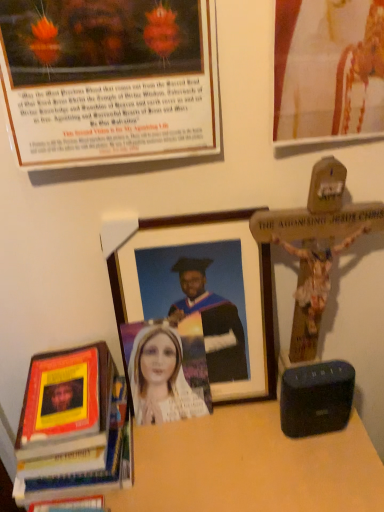
This screenshot has height=512, width=384. What do you see at coordinates (73, 424) in the screenshot?
I see `hardcover book at lower left` at bounding box center [73, 424].

Measure the distance between point (x=353, y=0) and camera.

A distance of 22.44 inches exists between point (x=353, y=0) and camera.

Describe the element at coordinates (328, 71) in the screenshot. I see `matte gold picture frame at upper right, the 3th picture frame positioned from the bottom` at that location.

Where is `matte plastic portrait at center`? The height and width of the screenshot is (512, 384). matte plastic portrait at center is located at coordinates (167, 370).

Identify the location of table on the left of matte gold picture frame at upper right, which is counted as the first picture frame, starting from the top. (250, 466).

Is wooden table at lower center to the left of matte gold picture frame at upper right, which is counted as the first picture frame, starting from the top, from the viewer's perspective?

Yes, wooden table at lower center is to the left of matte gold picture frame at upper right, which is counted as the first picture frame, starting from the top.

Could you tell me if wooden table at lower center is turned towards matte gold picture frame at upper right, the 3th picture frame positioned from the bottom?

No, wooden table at lower center is not aimed at matte gold picture frame at upper right, the 3th picture frame positioned from the bottom.

Based on the photo, how much distance is there between wooden table at lower center and matte gold picture frame at upper right, the 3th picture frame positioned from the bottom?

22.11 inches.

The height and width of the screenshot is (512, 384). Identify the location of the 2nd picture frame below the matte gold picture frame at upper right, the 3th picture frame positioned from the bottom (from the image's perspective). (200, 290).

Is point (326, 18) behind point (243, 368)?

No, it is in front of (243, 368).

Is there a large distance between matte gold picture frame at upper right, which is counted as the first picture frame, starting from the top, and wooden picture frame at center, acting as the 1th picture frame starting from the bottom?

No, matte gold picture frame at upper right, which is counted as the first picture frame, starting from the top, is not far away from wooden picture frame at center, acting as the 1th picture frame starting from the bottom.

From their relative heights in the image, would you say black plastic speaker at lower right is taller or shorter than wooden picture frame at center, placed as the third picture frame when sorted from top to bottom?

Clearly, black plastic speaker at lower right is shorter compared to wooden picture frame at center, placed as the third picture frame when sorted from top to bottom.

Can you tell me how much black plastic speaker at lower right and wooden picture frame at center, placed as the third picture frame when sorted from top to bottom, differ in facing direction?

The angular difference between black plastic speaker at lower right and wooden picture frame at center, placed as the third picture frame when sorted from top to bottom, is 6.21 degrees.

Looking at this image, who is smaller, black plastic speaker at lower right or wooden picture frame at center, placed as the third picture frame when sorted from top to bottom?

black plastic speaker at lower right is smaller.

In terms of size, does wooden table at lower center appear bigger or smaller than wooden picture frame at center, acting as the 1th picture frame starting from the bottom?

Considering their sizes, wooden table at lower center takes up more space than wooden picture frame at center, acting as the 1th picture frame starting from the bottom.

Considering the sizes of objects wooden table at lower center and wooden picture frame at center, placed as the third picture frame when sorted from top to bottom, in the image provided, who is taller, wooden table at lower center or wooden picture frame at center, placed as the third picture frame when sorted from top to bottom,?

wooden table at lower center is taller.

How different are the orientations of wooden table at lower center and wooden picture frame at center, acting as the 1th picture frame starting from the bottom, in degrees?

wooden table at lower center and wooden picture frame at center, acting as the 1th picture frame starting from the bottom, are facing 0.00174 degrees away from each other.

Which of these two, wooden table at lower center or wooden picture frame at center, placed as the third picture frame when sorted from top to bottom, is thinner?

wooden picture frame at center, placed as the third picture frame when sorted from top to bottom, is thinner.

The image size is (384, 512). Identify the location of woman above the black plastic speaker at lower right (from a real-world perspective). (167, 370).

Does point (154, 346) appear closer or farther from the camera than point (314, 412)?

Point (154, 346) appears to be farther away from the viewer than point (314, 412).

Does matte plastic portrait at center contain black plastic speaker at lower right?

No, black plastic speaker at lower right is not surrounded by matte plastic portrait at center.

Which point is more forward, (176,337) or (381,37)?

Answer: Point (381,37)

Measure the distance from matte plastic portrait at center to matte gold picture frame at upper right, which is counted as the first picture frame, starting from the top.

matte plastic portrait at center is 18.02 inches away from matte gold picture frame at upper right, which is counted as the first picture frame, starting from the top.

Where is `woman below the matte gold picture frame at upper right, the 3th picture frame positioned from the bottom (from a real-world perspective)`? woman below the matte gold picture frame at upper right, the 3th picture frame positioned from the bottom (from a real-world perspective) is located at coordinates (167, 370).

Is matte wooden picture frame at upper left, the 2th picture frame in the top-to-bottom sequence, further to the viewer compared to wooden table at lower center?

No.

Can we say matte wooden picture frame at upper left, which is the 2th picture frame in bottom-to-top order, lies outside wooden table at lower center?

Indeed, matte wooden picture frame at upper left, which is the 2th picture frame in bottom-to-top order, is completely outside wooden table at lower center.

Is point (186, 76) closer or farther from the camera than point (176, 471)?

Point (186, 76).

Based on their positions, is matte wooden picture frame at upper left, which is the 2th picture frame in bottom-to-top order, located to the left or right of wooden table at lower center?

From the image, it's evident that matte wooden picture frame at upper left, which is the 2th picture frame in bottom-to-top order, is to the left of wooden table at lower center.

Find the location of `table located behind the matte gold picture frame at upper right, which is counted as the first picture frame, starting from the top`. table located behind the matte gold picture frame at upper right, which is counted as the first picture frame, starting from the top is located at coordinates (250, 466).

Locate an element on the screen. picture frame on the right of wooden picture frame at center, acting as the 1th picture frame starting from the bottom is located at coordinates (328, 71).

Looking at the image, which one is located further to wooden picture frame at center, placed as the third picture frame when sorted from top to bottom, black plastic speaker at lower right or matte wooden picture frame at upper left, which is the 2th picture frame in bottom-to-top order?

The object further to wooden picture frame at center, placed as the third picture frame when sorted from top to bottom, is matte wooden picture frame at upper left, which is the 2th picture frame in bottom-to-top order.

When comparing their distances from hardcover book at lower left, does wooden table at lower center or matte wooden picture frame at upper left, which is the 2th picture frame in bottom-to-top order, seem further?

Among the two, matte wooden picture frame at upper left, which is the 2th picture frame in bottom-to-top order, is located further to hardcover book at lower left.

In the scene shown: When comparing their distances from wooden picture frame at center, placed as the third picture frame when sorted from top to bottom, does matte plastic portrait at center or wooden table at lower center seem further?

wooden table at lower center.

Considering their positions, is black plastic speaker at lower right positioned further to matte plastic portrait at center than wooden table at lower center?

black plastic speaker at lower right is further to matte plastic portrait at center.

Which object lies further to the anchor point matte wooden picture frame at upper left, which is the 2th picture frame in bottom-to-top order, hardcover book at lower left or wooden picture frame at center, acting as the 1th picture frame starting from the bottom?

Based on the image, hardcover book at lower left appears to be further to matte wooden picture frame at upper left, which is the 2th picture frame in bottom-to-top order.

Based on their spatial positions, is hardcover book at lower left or matte gold picture frame at upper right, the 3th picture frame positioned from the bottom, further from wooden picture frame at center, placed as the third picture frame when sorted from top to bottom?

matte gold picture frame at upper right, the 3th picture frame positioned from the bottom, is further to wooden picture frame at center, placed as the third picture frame when sorted from top to bottom.

Considering their positions, is black plastic speaker at lower right positioned further to wooden table at lower center than wooden picture frame at center, placed as the third picture frame when sorted from top to bottom?

wooden picture frame at center, placed as the third picture frame when sorted from top to bottom, is positioned further to the anchor wooden table at lower center.

Estimate the real-world distances between objects in this image. Which object is closer to black plastic speaker at lower right, matte gold picture frame at upper right, the 3th picture frame positioned from the bottom, or wooden table at lower center?

Among the two, wooden table at lower center is located nearer to black plastic speaker at lower right.

This screenshot has height=512, width=384. Find the location of `picture frame between matte wooden picture frame at upper left, which is the 2th picture frame in bottom-to-top order, and hardcover book at lower left from top to bottom`. picture frame between matte wooden picture frame at upper left, which is the 2th picture frame in bottom-to-top order, and hardcover book at lower left from top to bottom is located at coordinates (200, 290).

The height and width of the screenshot is (512, 384). In order to click on speaker between matte wooden picture frame at upper left, which is the 2th picture frame in bottom-to-top order, and wooden table at lower center in the up-down direction in this screenshot , I will do (316, 398).

The width and height of the screenshot is (384, 512). In order to click on woman between matte wooden picture frame at upper left, the 2th picture frame in the top-to-bottom sequence, and wooden table at lower center vertically in this screenshot , I will do `click(167, 370)`.

Locate an element on the screen. Image resolution: width=384 pixels, height=512 pixels. speaker between matte gold picture frame at upper right, the 3th picture frame positioned from the bottom, and hardcover book at lower left from top to bottom is located at coordinates (316, 398).